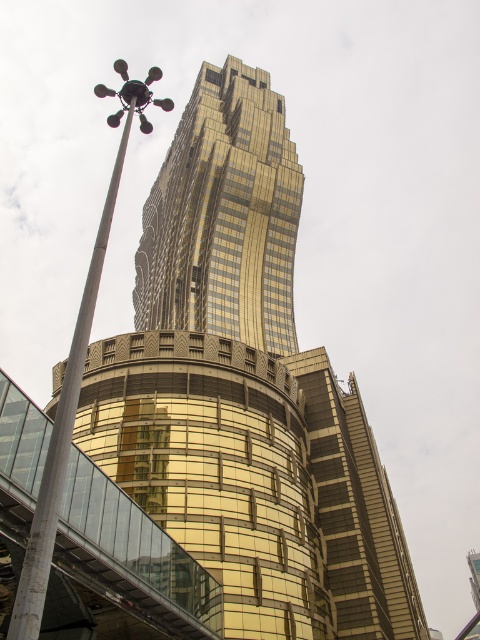
Is point (257, 193) positioned after point (22, 580)?

Yes, point (257, 193) is behind point (22, 580).

Which of these two, gold reflective glass tower at center or polished metal pole at center-left, stands shorter?

With less height is gold reflective glass tower at center.

This screenshot has width=480, height=640. I want to click on gold reflective glass tower at center, so click(x=224, y=216).